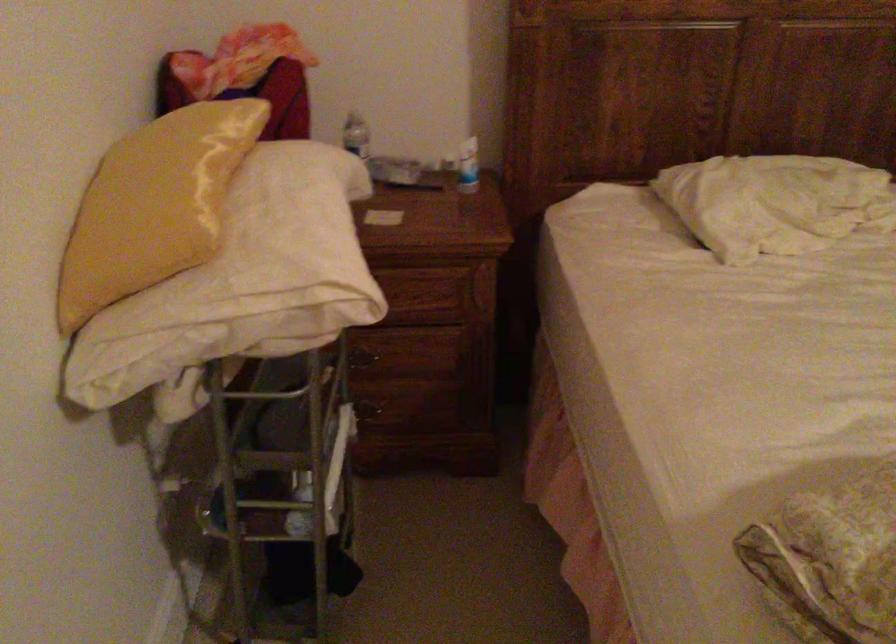
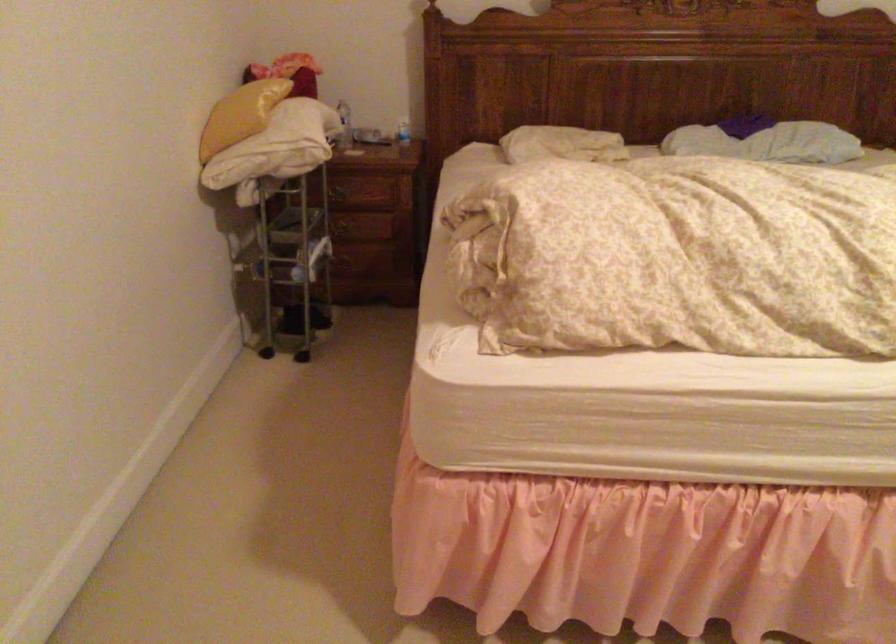
Locate, in the second image, the point that corresponds to point (366, 187) in the first image.

(343, 125)